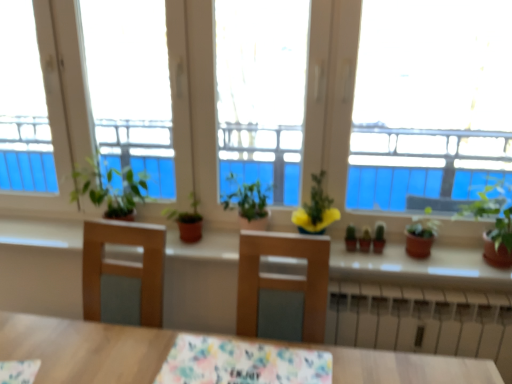
Question: In the image, is green matte cactus at center, marked as the 1th plant in a left-to-right arrangement, on the left side or the right side of green matte plant at center, which is the 1th plant in right-to-left order?

Choices:
 (A) right
 (B) left

Answer: (B)

Question: Which is correct: green matte cactus at center, marked as the 1th plant in a left-to-right arrangement, is inside green matte plant at center, which is the 1th plant in right-to-left order, or outside of it?

Choices:
 (A) inside
 (B) outside

Answer: (B)

Question: Estimate the real-world distances between objects in this image. Which object is farther from the yellow matte flower pot at center, the third houseplant when ordered from left to right?

Choices:
 (A) green matte plant at right, the fifth houseplant positioned from the left
 (B) green matte plant at center, which is the 4th houseplant in right-to-left order
 (C) floral fabric tablecloth at center
 (D) green matte plant at center, the 5th houseplant from the right
 (E) white metallic radiator at lower center

Answer: (C)

Question: Estimate the real-world distances between objects in this image. Which object is farther from the white metallic radiator at lower center?

Choices:
 (A) green matte cactus at center, the 2th plant viewed from the right
 (B) beige concrete window sill at center
 (C) green matte plant at center, which is the 1th plant in right-to-left order
 (D) matte brown pot at right, which is the second houseplant from right to left
 (E) yellow matte flower pot at center, which ranks as the third houseplant in right-to-left order

Answer: (E)